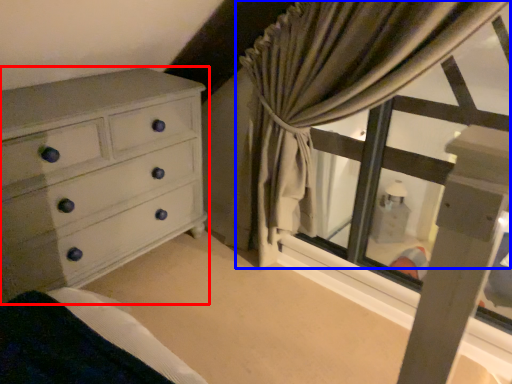
Question: Which object appears farthest to the camera in this image, chest of drawers (highlighted by a red box) or curtain (highlighted by a blue box)?

Choices:
 (A) chest of drawers
 (B) curtain

Answer: (A)